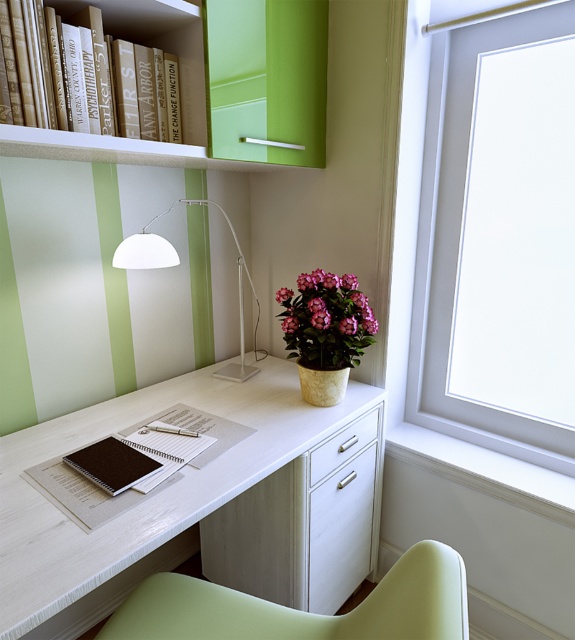
Between light green matte stripe at left and white matte lamp at upper left, which one is positioned higher?

white matte lamp at upper left is above.

Does light green matte stripe at left appear on the left side of white matte lamp at upper left?

Yes, light green matte stripe at left is to the left of white matte lamp at upper left.

Describe the element at coordinates (12, 342) in the screenshot. This screenshot has height=640, width=575. I see `light green matte stripe at left` at that location.

The image size is (575, 640). Find the location of `light green matte stripe at left`. light green matte stripe at left is located at coordinates (12, 342).

Between point (101, 0) and point (116, 300), which one is positioned in front?

Point (101, 0)

Identify the location of hardcover book at upper left. (158, 44).

Is transparent glass window at upper right below matte black notebook at center?

No.

Does transparent glass window at upper right have a greater height compared to matte black notebook at center?

Indeed, transparent glass window at upper right has a greater height compared to matte black notebook at center.

Describe the element at coordinates (458, 243) in the screenshot. I see `transparent glass window at upper right` at that location.

Locate an element on the screen. transparent glass window at upper right is located at coordinates (458, 243).